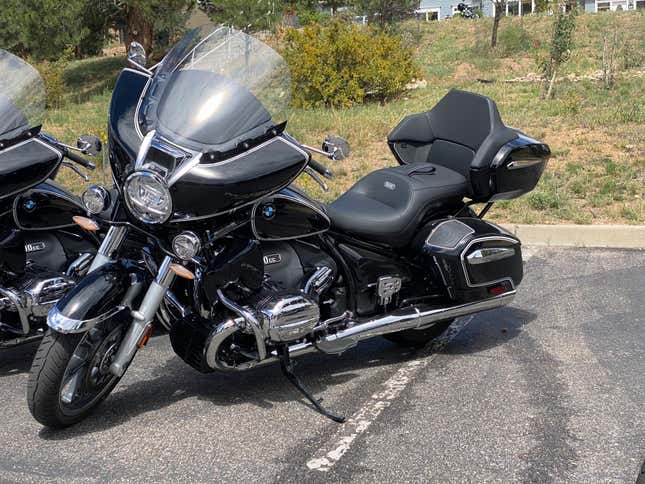
At what (x,y) coordinates should I click in order to perform the action: click on mirror. Please return your answer as a coordinate pair (x, y). This screenshot has width=645, height=484. Looking at the image, I should click on (339, 149), (135, 49), (94, 145).